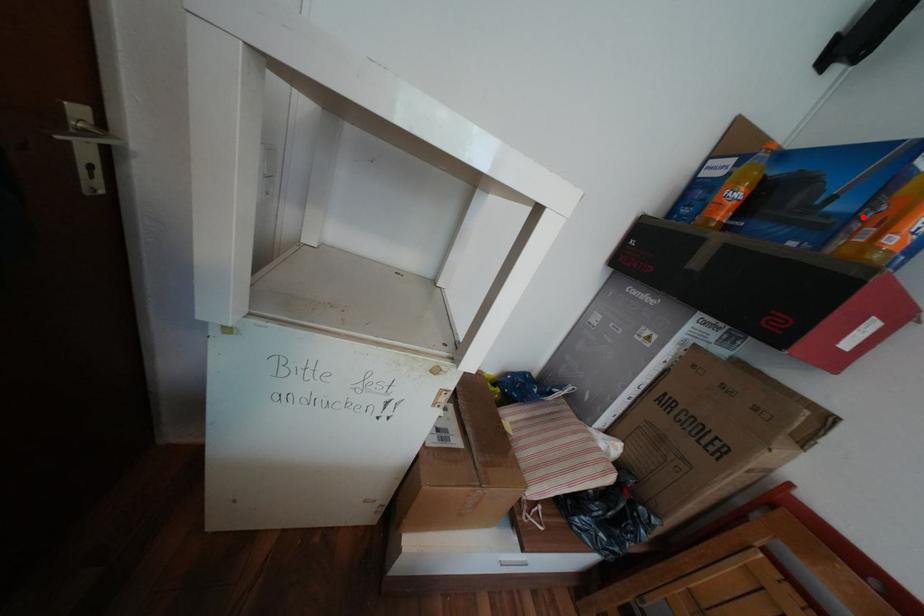
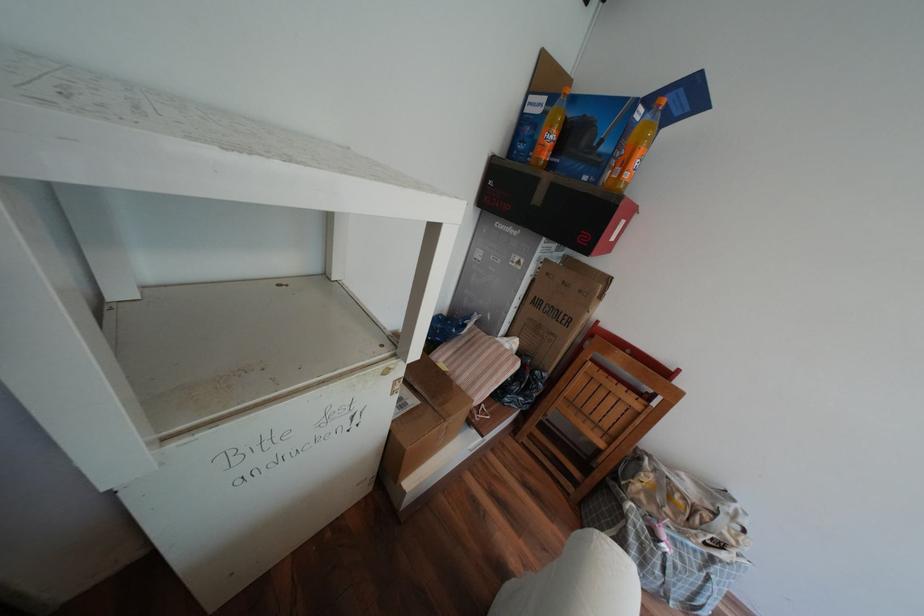
Where in the second image is the point corresponding to the highlighted location from the first image?

(621, 156)